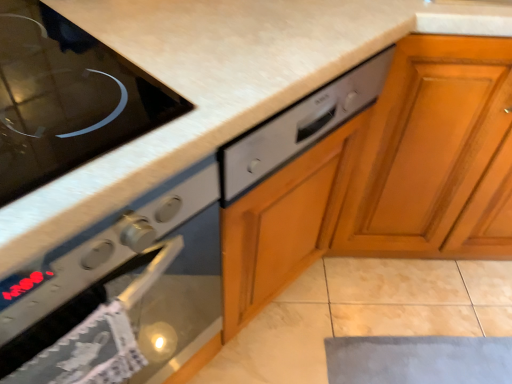
Question: Considering the positions of black glass cooktop at upper left and satin silver dishwasher at center in the image, is black glass cooktop at upper left taller or shorter than satin silver dishwasher at center?

Choices:
 (A) tall
 (B) short

Answer: (B)

Question: Would you say black glass cooktop at upper left is inside or outside satin silver dishwasher at center?

Choices:
 (A) outside
 (B) inside

Answer: (A)

Question: Considering the real-world distances, which object is farthest from the satin silver oven at left?

Choices:
 (A) wooden cabinet at right
 (B) satin silver dishwasher at center
 (C) black glass cooktop at upper left

Answer: (A)

Question: Considering the real-world distances, which object is farthest from the satin silver dishwasher at center?

Choices:
 (A) black glass cooktop at upper left
 (B) wooden cabinet at right
 (C) satin silver oven at left

Answer: (B)